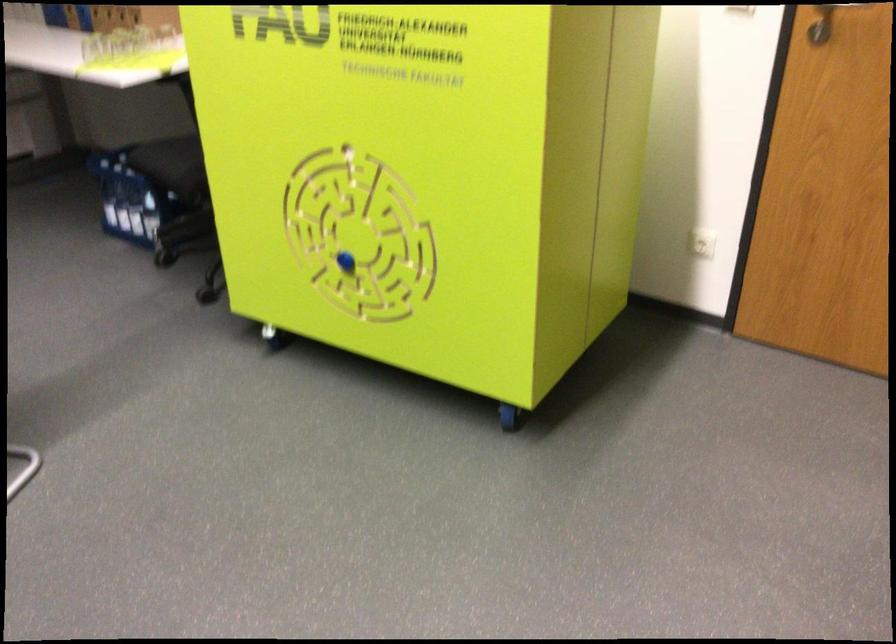
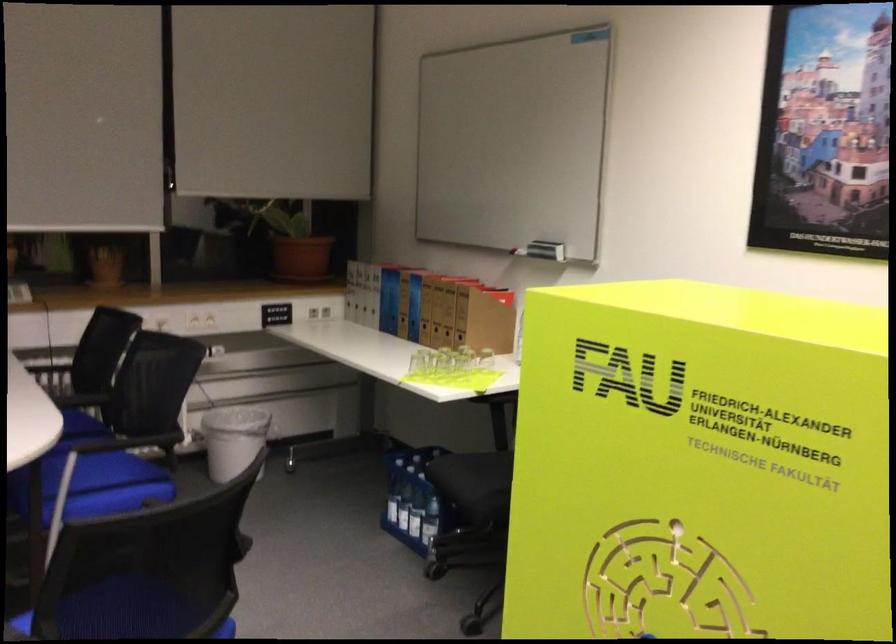
Locate, in the second image, the point that corresponds to (x=139, y=210) in the first image.

(416, 514)